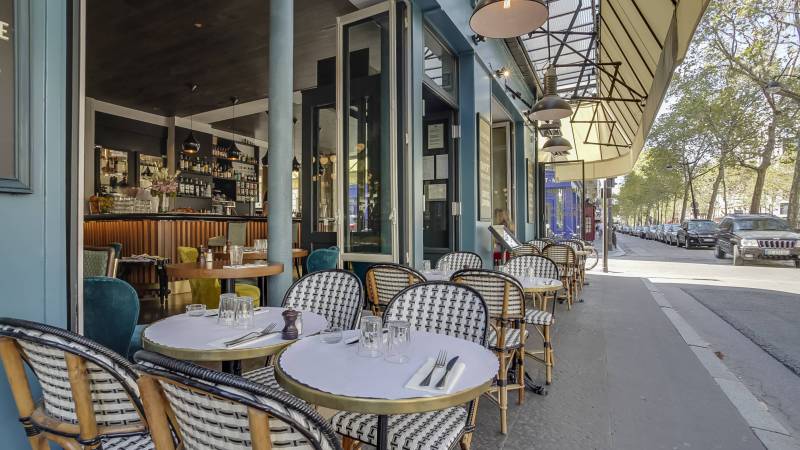
Identify the location of lights. (528, 16), (556, 107), (558, 147), (500, 72), (192, 143), (230, 156), (266, 159), (296, 164).